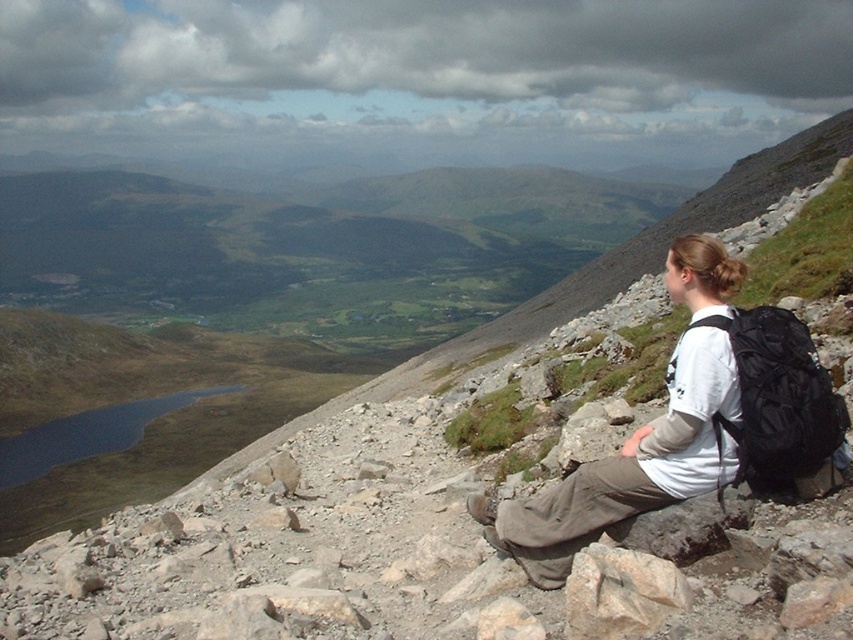
Question: Is white cotton shirt at center bigger than black fabric backpack at right?

Choices:
 (A) no
 (B) yes

Answer: (B)

Question: Does black fabric backpack at right have a larger size compared to rough textured rock at lower right?

Choices:
 (A) no
 (B) yes

Answer: (B)

Question: Which object is farther from the camera taking this photo?

Choices:
 (A) rough textured rock at lower right
 (B) black fabric backpack at right
 (C) white cotton shirt at center

Answer: (C)

Question: Estimate the real-world distances between objects in this image. Which object is closer to the white cotton shirt at center?

Choices:
 (A) black fabric backpack at right
 (B) rough textured rock at lower right

Answer: (A)

Question: Is black fabric backpack at right positioned before rough textured rock at lower right?

Choices:
 (A) yes
 (B) no

Answer: (B)

Question: Estimate the real-world distances between objects in this image. Which object is closer to the rough textured rock at lower right?

Choices:
 (A) black fabric backpack at right
 (B) white cotton shirt at center

Answer: (B)